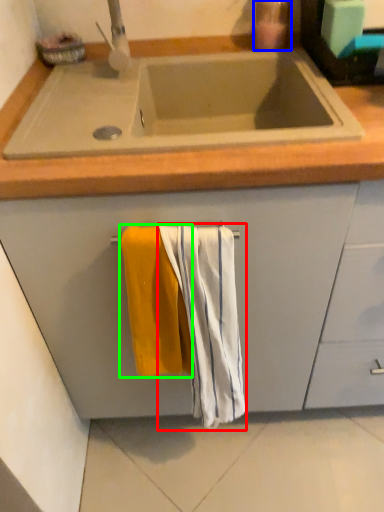
Question: Which is nearer to the beach towel (highlighted by a red box)? soap dispenser (highlighted by a blue box) or beach towel (highlighted by a green box).

Choices:
 (A) soap dispenser
 (B) beach towel

Answer: (B)